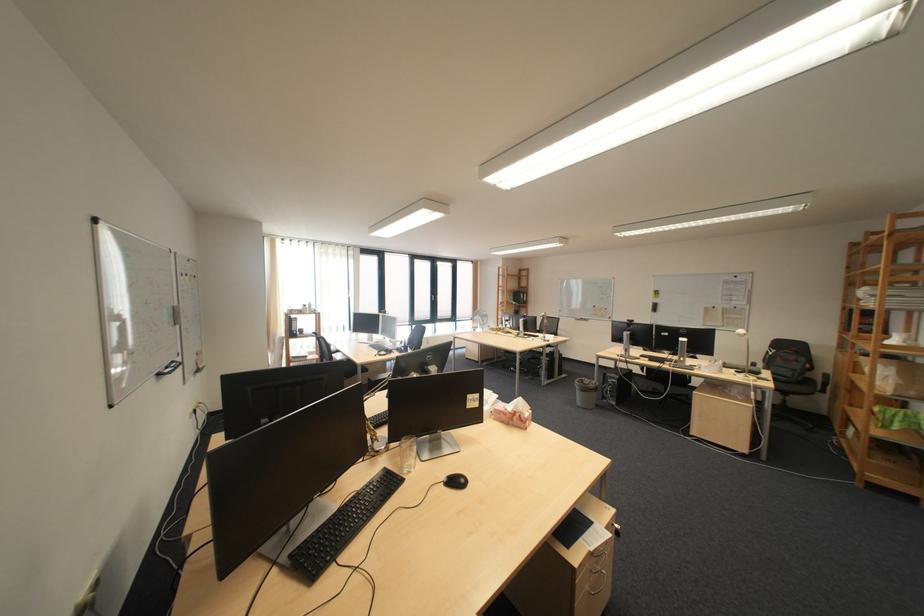
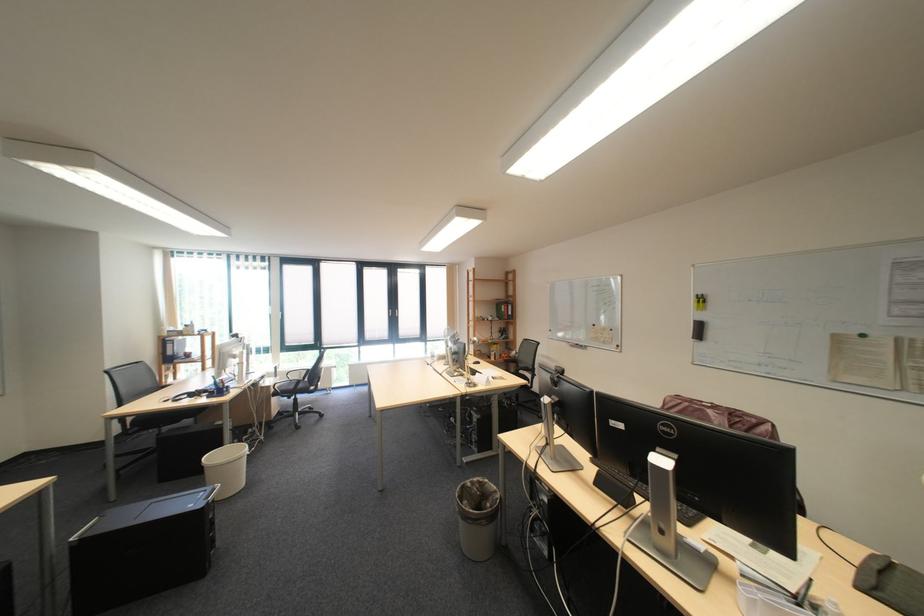
What movement of the cameraman would produce the second image?

The cameraman moved toward right, forward.